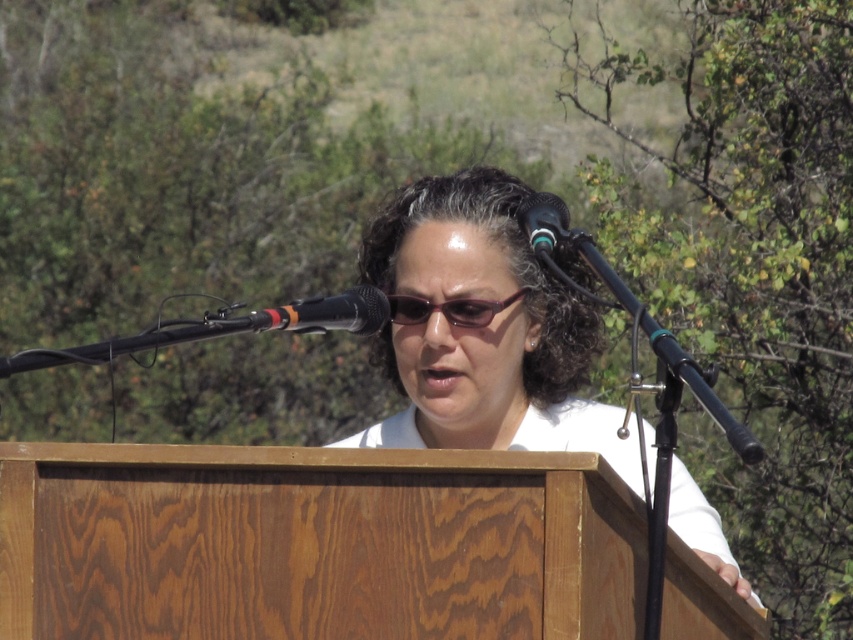
You are a speaker at an outdoor event and need to adjust the microphones. Which microphone, the black metallic microphone at center or the black plastic microphone at upper center, is positioned higher?

The black plastic microphone at upper center is positioned higher than the black metallic microphone at center.

Looking at this image, you are a photographer positioned behind the speaker. You want to take a photo of the matte white shirt at center so that it is clearly visible against the background. Given that the two microphones in front are 2.56 meters apart, what is the minimum distance you should maintain between the speaker and the microphones to ensure the shirt remains in focus?

The minimum distance should be at least 2.56 meters to ensure the matte white shirt at center stays in focus and isn

You are a photographer positioned behind the speaker at the podium. You need to capture a closeup shot of both the black metallic microphone at center and the purple shiny glasses at center. Given that your camera can focus on objects within a 15 inch range, will you be able to include both in the same frame without moving the camera?

The black metallic microphone at center is 15.49 inches away from the purple shiny glasses at center. Since the distance between them exceeds the camera focus range of 15 inches, you will not be able to capture both in the same frame without moving the camera.